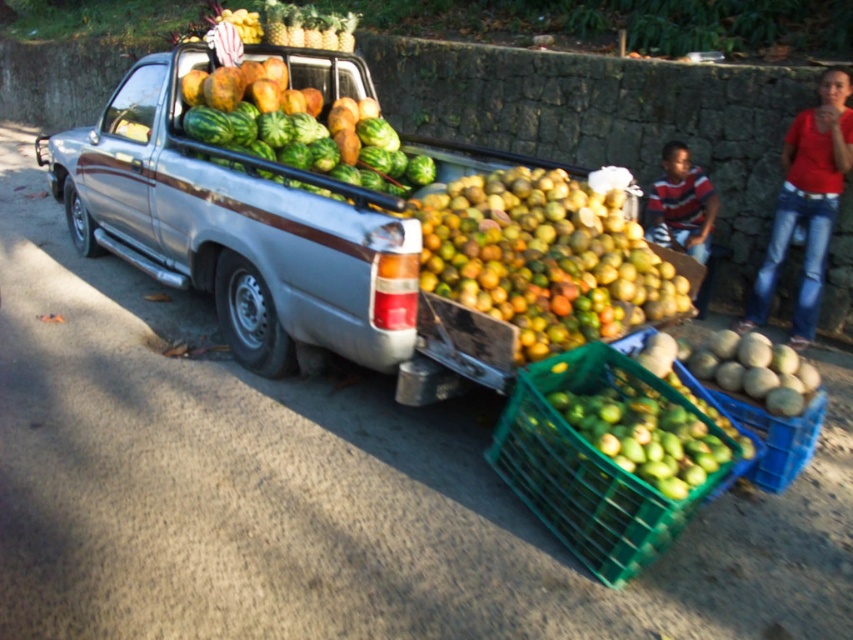
Question: Is silver metallic truck at center bigger than green matte melon at center?

Choices:
 (A) yes
 (B) no

Answer: (A)

Question: Which of the following is the farthest from the observer?

Choices:
 (A) (393, 284)
 (B) (247, 136)
 (C) (809, 148)

Answer: (C)

Question: Which point is farther to the camera?

Choices:
 (A) green matte watermelons at center
 (B) striped shirt at center
 (C) red cotton shirt at right

Answer: (B)

Question: Is yellow-green matte citrus at center positioned behind green plastic crate at lower center?

Choices:
 (A) no
 (B) yes

Answer: (B)

Question: Is green matte watermelons at center positioned at the back of green matte melon at center?

Choices:
 (A) no
 (B) yes

Answer: (B)

Question: Which point is farther to the camera?

Choices:
 (A) (828, 180)
 (B) (610, 410)

Answer: (A)